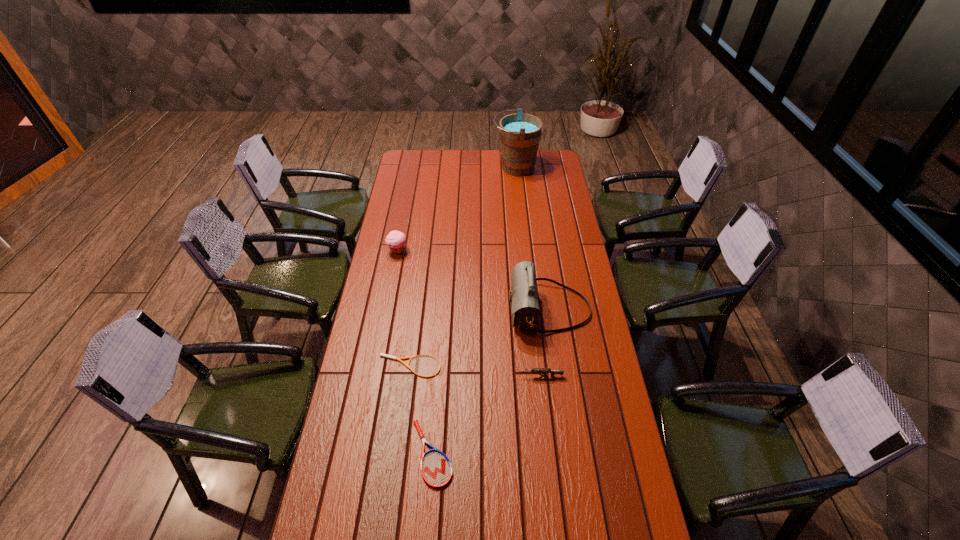
This screenshot has width=960, height=540. What are the coordinates of `vacant position in the image that satisfies the following two spatial constraints: 1. on the back side of the fourth nearest object; 2. with a handle on the side of the tallest object` in the screenshot? It's located at (529, 167).